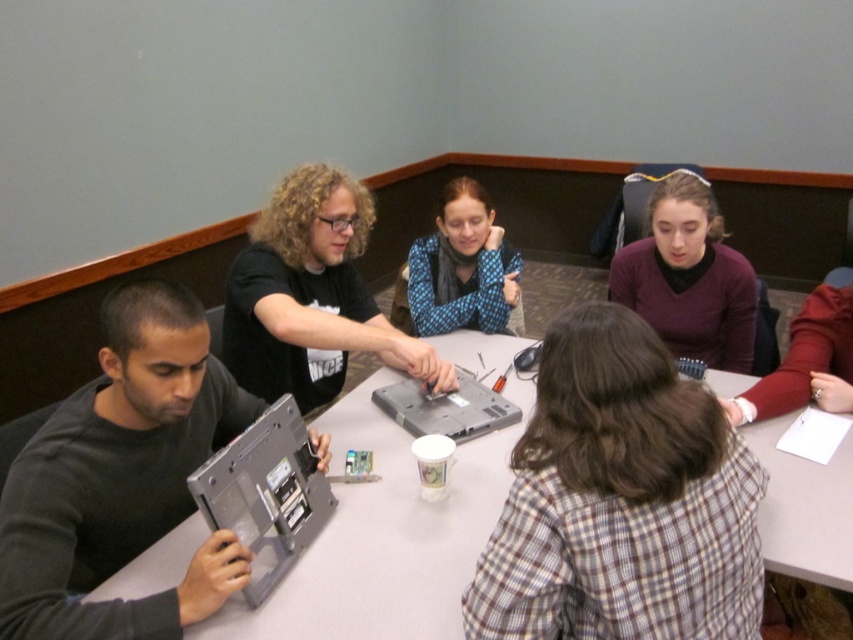
You are observing a group of people working on a project. You notice two individuals wearing the black matte shirt at center and the blue dotted sweater at center. Which person is closer to you?

The black matte shirt at center is in front of the blue dotted sweater at center, so the person wearing the black matte shirt at center is closer to you.

You are a fashion designer observing the group and their clothing. You need to determine which sweater, the matte purple sweater at center or the blue dotted sweater at center, is narrower in width. Which one is narrower?

The matte purple sweater at center is narrower in width than the blue dotted sweater at center as stated in the description.